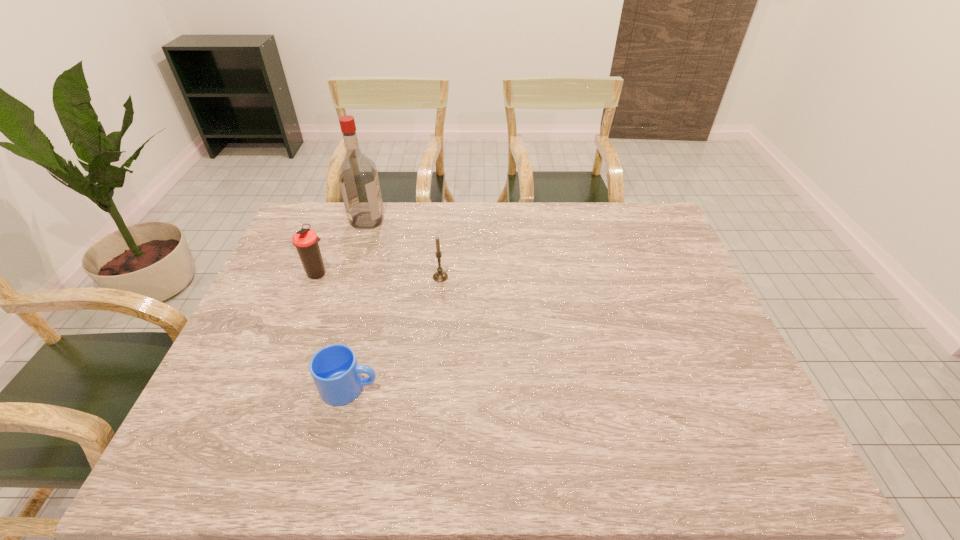
Find the location of a particular element. The image size is (960, 540). liquor is located at coordinates (358, 178).

Locate an element on the screen. the tallest object is located at coordinates (358, 178).

Find the location of a particular element. The image size is (960, 540). the leftmost object is located at coordinates (306, 240).

The width and height of the screenshot is (960, 540). I want to click on candle, so click(x=440, y=276).

Image resolution: width=960 pixels, height=540 pixels. In order to click on the shortest object in this screenshot , I will do `click(334, 368)`.

Image resolution: width=960 pixels, height=540 pixels. In order to click on the nearest object in this screenshot , I will do `click(334, 368)`.

The width and height of the screenshot is (960, 540). I want to click on vacant space located on the front-facing side of the liquor, so click(444, 220).

Locate an element on the screen. The width and height of the screenshot is (960, 540). free region located 0.060m on the left of the thermos bottle is located at coordinates (285, 273).

Locate an element on the screen. free space located 0.090m on the right of the rightmost object is located at coordinates [x=478, y=277].

What are the coordinates of `free region located on the side of the nearest object with the handle` in the screenshot? It's located at (468, 388).